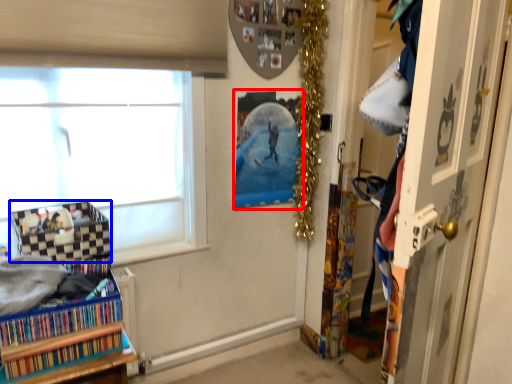
Question: Which object appears farthest to the camera in this image, picture frame (highlighted by a red box) or shelf (highlighted by a blue box)?

Choices:
 (A) picture frame
 (B) shelf

Answer: (A)